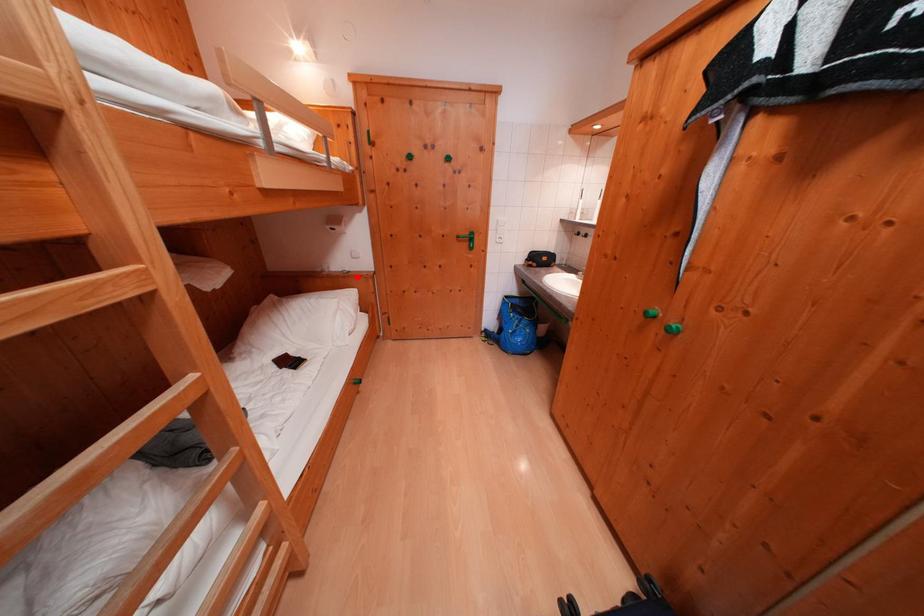
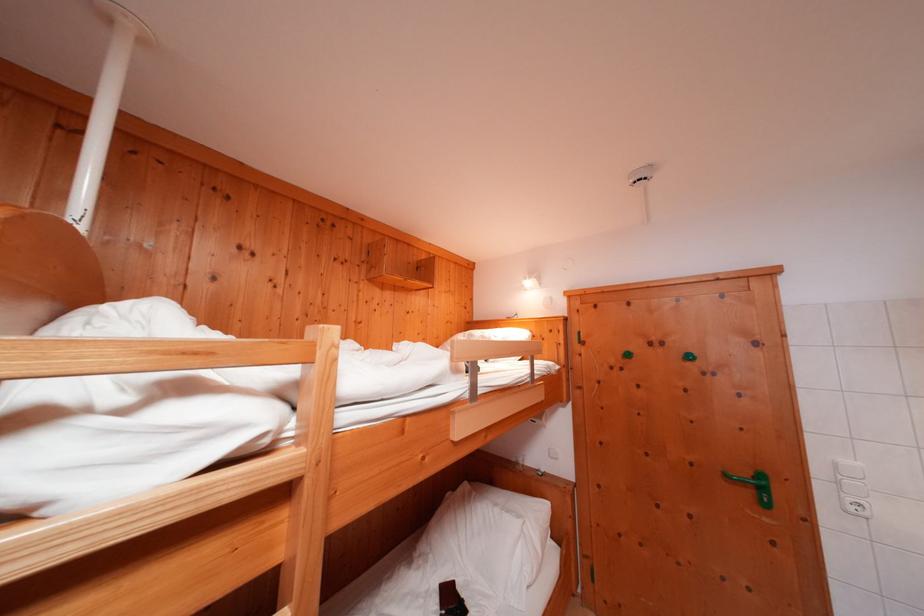
Question: I am providing you with two images of the same scene from different viewpoints. In image1, a red point is highlighted. Considering the same 3D point in image2, which of the following is correct?

Choices:
 (A) It is closer
 (B) It is farther

Answer: (B)